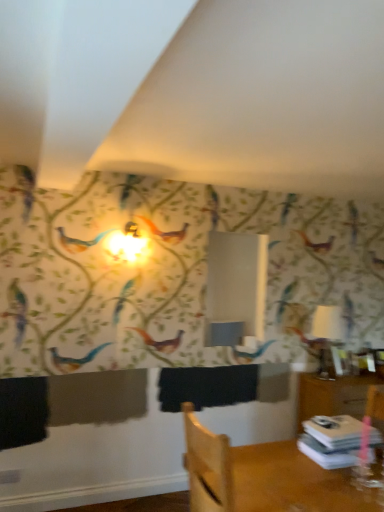
This screenshot has height=512, width=384. What do you see at coordinates (326, 333) in the screenshot?
I see `white glossy table lamp at right` at bounding box center [326, 333].

Where is `white glossy table lamp at right`? Image resolution: width=384 pixels, height=512 pixels. white glossy table lamp at right is located at coordinates (326, 333).

Identify the location of table lamp lying above the white paper stack at lower right (from the image's perspective). tap(326, 333).

Choose the correct answer: Is white glossy table lamp at right inside white paper stack at lower right or outside it?

white glossy table lamp at right is located beyond the bounds of white paper stack at lower right.

Is white glossy table lamp at right in contact with white paper stack at lower right?

No, white glossy table lamp at right is not in contact with white paper stack at lower right.

Does white glossy table lamp at right have a larger size compared to white paper stack at lower right?

Yes, white glossy table lamp at right is bigger than white paper stack at lower right.

What are the coordinates of `table lamp above the white paper stack at lower right (from the image's perspective)` in the screenshot? It's located at (326, 333).

Is white paper stack at lower right turned away from white glossy table lamp at right?

No.

Which of these two, white paper stack at lower right or white glossy table lamp at right, is bigger?

white glossy table lamp at right is bigger.

From a real-world perspective, is white paper stack at lower right on top of wooden chair at lower right?

Yes, from a real-world perspective, white paper stack at lower right is on top of wooden chair at lower right.

Is wooden chair at lower right at the back of white paper stack at lower right?

Yes, white paper stack at lower right is facing away from wooden chair at lower right.

In the scene shown: Can you confirm if white paper stack at lower right is thinner than wooden chair at lower right?

Yes.

Is white paper stack at lower right closer to the viewer compared to wooden chair at lower right?

No, it is behind wooden chair at lower right.

From the image's perspective, relative to wooden chair at lower right, is white glossy table lamp at right above or below?

Clearly, from the image's perspective, white glossy table lamp at right is above wooden chair at lower right.

Is white glossy table lamp at right at the right side of wooden chair at lower right?

Yes, white glossy table lamp at right is to the right of wooden chair at lower right.

Considering the relative sizes of white glossy table lamp at right and wooden chair at lower right in the image provided, is white glossy table lamp at right shorter than wooden chair at lower right?

No, white glossy table lamp at right is not shorter than wooden chair at lower right.

What's the angular difference between white glossy table lamp at right and wooden chair at lower right's facing directions?

The angular difference between white glossy table lamp at right and wooden chair at lower right is 81.3 degrees.

Does point (217, 482) come farther from viewer compared to point (344, 454)?

No, (217, 482) is in front of (344, 454).

Where is `furniture located in front of the white paper stack at lower right`? furniture located in front of the white paper stack at lower right is located at coordinates (262, 476).

Is wooden chair at lower right shorter than white paper stack at lower right?

No, wooden chair at lower right is not shorter than white paper stack at lower right.

Is wooden chair at lower right spatially inside white paper stack at lower right, or outside of it?

wooden chair at lower right is located beyond the bounds of white paper stack at lower right.

Where is `furniture below the white glossy table lamp at right (from a real-world perspective)`? furniture below the white glossy table lamp at right (from a real-world perspective) is located at coordinates (262, 476).

Is wooden chair at lower right directly adjacent to white glossy table lamp at right?

There is a gap between wooden chair at lower right and white glossy table lamp at right.

Can you tell me how much wooden chair at lower right and white glossy table lamp at right differ in facing direction?

81.3 degrees.

From the image's perspective, does wooden chair at lower right appear lower than white glossy table lamp at right?

Yes, from the image's perspective, wooden chair at lower right is below white glossy table lamp at right.

I want to click on book directly beneath the white glossy table lamp at right (from a real-world perspective), so click(331, 440).

Identify the location of table lamp located behind the white paper stack at lower right. (326, 333).

Based on the photo, when comparing their distances from wooden chair at lower right, does white glossy table lamp at right or white paper stack at lower right seem further?

white glossy table lamp at right.

Considering their positions, is white glossy table lamp at right positioned closer to white paper stack at lower right than wooden chair at lower right?

wooden chair at lower right is closer to white paper stack at lower right.

Based on their spatial positions, is white paper stack at lower right or wooden chair at lower right further from white glossy table lamp at right?

wooden chair at lower right is positioned further to the anchor white glossy table lamp at right.

From the image, which object appears to be nearer to white glossy table lamp at right, wooden chair at lower right or white paper stack at lower right?

white paper stack at lower right.

Looking at the image, which one is located further to wooden chair at lower right, white paper stack at lower right or white glossy table lamp at right?

white glossy table lamp at right.

Based on their spatial positions, is wooden chair at lower right or white glossy table lamp at right closer to white paper stack at lower right?

Among the two, wooden chair at lower right is located nearer to white paper stack at lower right.

Locate an element on the screen. This screenshot has height=512, width=384. book located between wooden chair at lower right and white glossy table lamp at right in the depth direction is located at coordinates (331, 440).